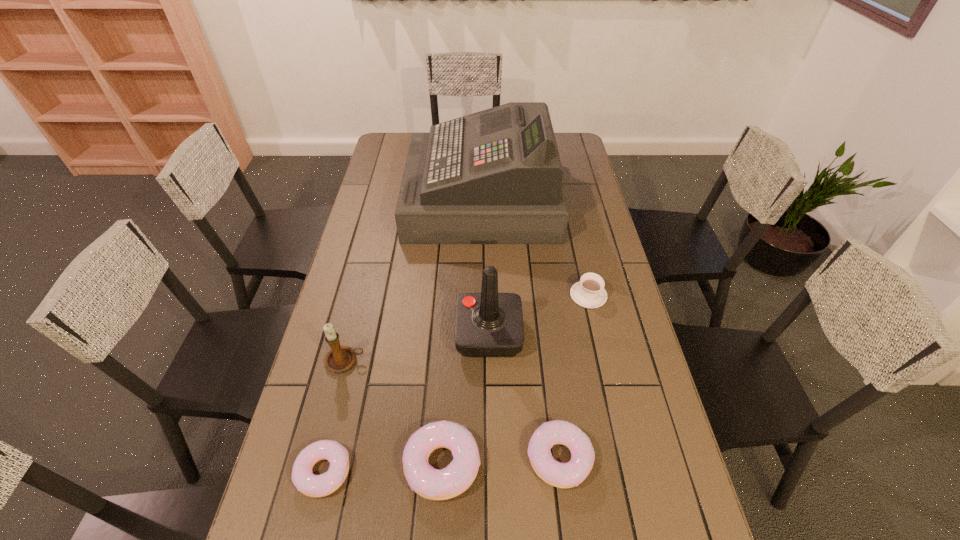
At what (x,y) coordinates should I click in order to perform the action: click on doughnut positioned at the left edge. Please return your answer as a coordinate pair (x, y). This screenshot has height=540, width=960. Looking at the image, I should click on pos(311,485).

Where is `candle holder located in the left edge section of the desktop`? candle holder located in the left edge section of the desktop is located at coordinates (341, 358).

This screenshot has width=960, height=540. Identify the location of cash register present at the right edge. (492, 177).

Locate an element on the screen. teacup located in the right edge section of the desktop is located at coordinates (589, 292).

Where is `object that is at the near left corner`? The width and height of the screenshot is (960, 540). object that is at the near left corner is located at coordinates (311, 485).

Find the location of a particular element. Image resolution: width=960 pixels, height=540 pixels. free region at the left edge of the desktop is located at coordinates (324, 376).

You are a GUI agent. You are given a task and a screenshot of the screen. Output one action in this format:
    pyautogui.click(x=<x>, y=<y>)
    Task: Click on the vacant space at the right edge
    The image size is (960, 540).
    Given the screenshot: What is the action you would take?
    pyautogui.click(x=571, y=250)

Locate an element on the screen. unoccupied area between the second shortest doughnut and the teacup is located at coordinates (574, 376).

Identify the location of unoccupied position between the second farthest object and the joystick. (539, 315).

Locate an element on the screen. empty space that is in between the cash register and the candle holder is located at coordinates (414, 280).